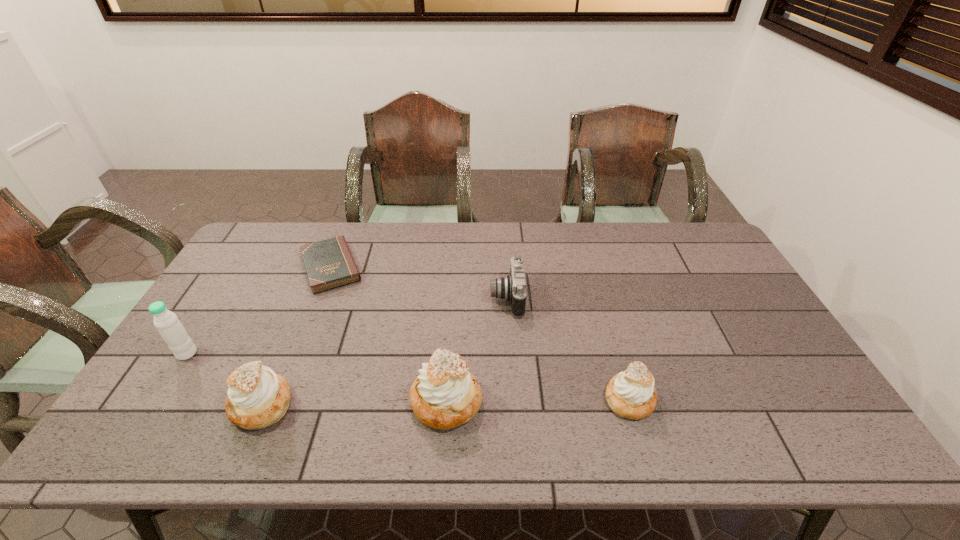
Identify the location of the second tallest pastry. The width and height of the screenshot is (960, 540). (257, 398).

Where is `the second pastry from left to right`? The width and height of the screenshot is (960, 540). the second pastry from left to right is located at coordinates (445, 395).

Locate an element on the screen. the rightmost object is located at coordinates (631, 394).

What are the coordinates of `the shortest pastry` in the screenshot? It's located at (631, 394).

I want to click on the shortest object, so click(x=329, y=264).

Where is `the second object from right to left`? The height and width of the screenshot is (540, 960). the second object from right to left is located at coordinates (513, 287).

The width and height of the screenshot is (960, 540). Identify the location of the leftmost object. (170, 328).

Find the location of `the third farthest object`. the third farthest object is located at coordinates (170, 328).

I want to click on free space located 0.190m on the back of the leftmost pastry, so click(x=296, y=324).

Locate an element on the screen. This screenshot has height=540, width=960. free space located 0.360m on the right of the fourth object from left to right is located at coordinates (630, 402).